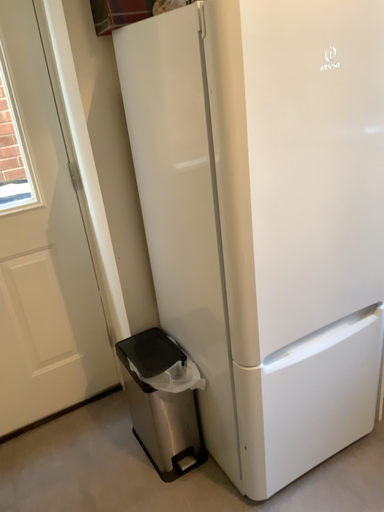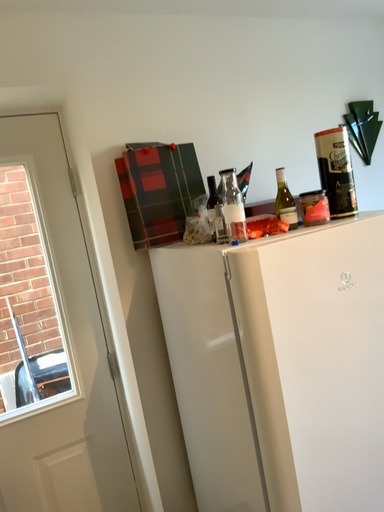
Question: How did the camera likely rotate when shooting the video?

Choices:
 (A) rotated downward
 (B) rotated upward

Answer: (B)